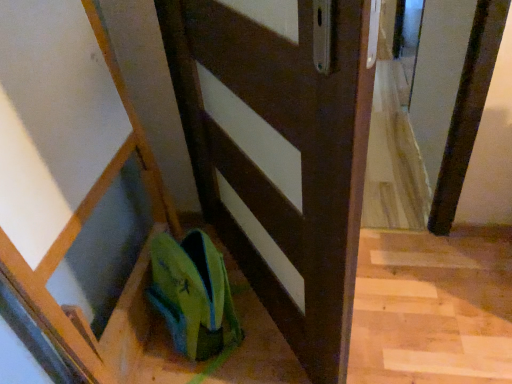
I want to click on spots to the right of matte brown door at center, so click(420, 297).